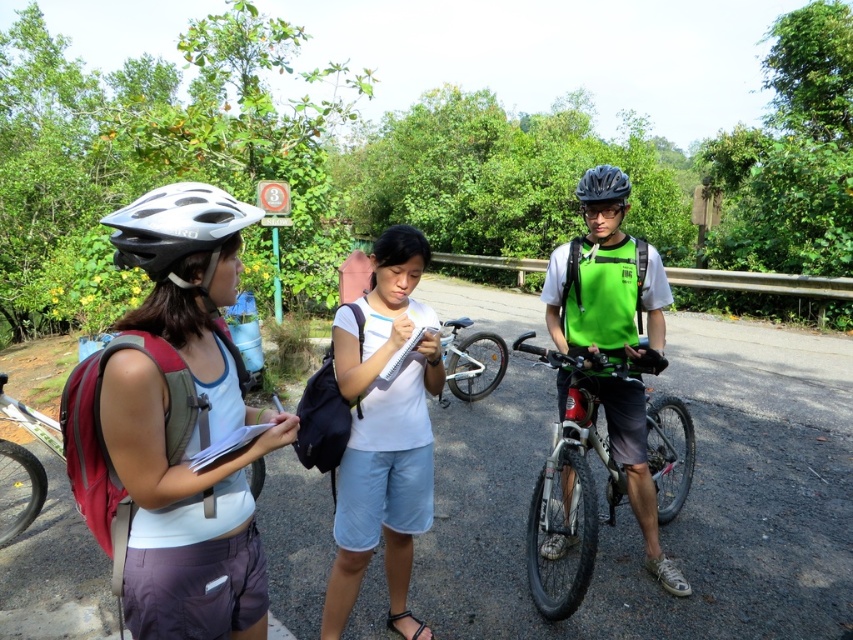
Question: Does white matte shirt at center come behind black matte helmet at center?

Choices:
 (A) no
 (B) yes

Answer: (A)

Question: Which object is closer to the camera taking this photo?

Choices:
 (A) white matte helmet at left
 (B) matte black bicycle at left
 (C) black matte helmet at center

Answer: (A)

Question: Does white matte shirt at center appear under shiny metallic bicycle at center?

Choices:
 (A) yes
 (B) no

Answer: (B)

Question: Based on their relative distances, which object is farther from the white matte bicycle helmet at left?

Choices:
 (A) silver metallic bicycle at center
 (B) white matte helmet at left
 (C) matte black bicycle at left
 (D) shiny metallic bicycle at center

Answer: (A)

Question: Which of the following is the farthest from the observer?

Choices:
 (A) (109, 371)
 (B) (694, 451)
 (C) (129, 243)

Answer: (B)

Question: Can you confirm if shiny metallic bicycle at center is bigger than black matte helmet at center?

Choices:
 (A) no
 (B) yes

Answer: (B)